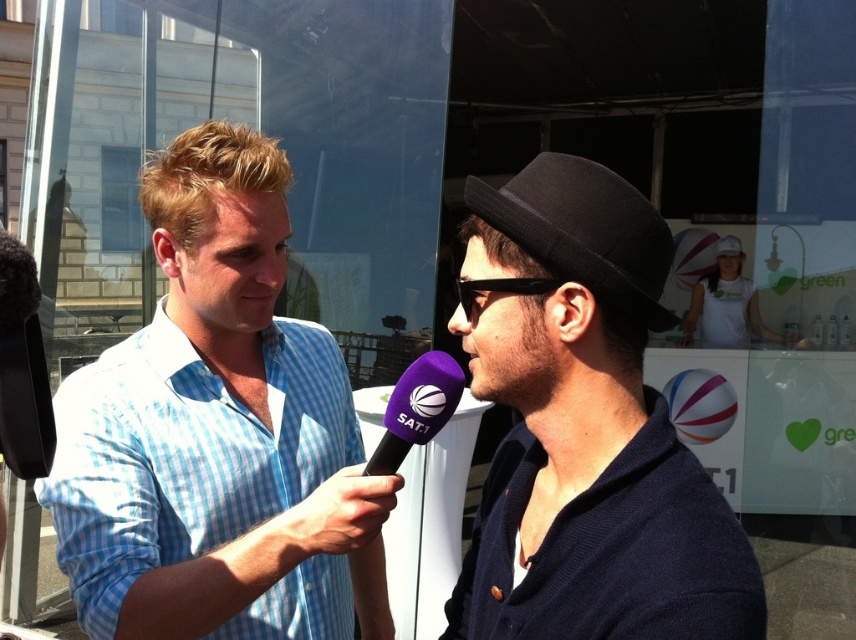
Question: Which is nearer to the blue checkered shirt at left?

Choices:
 (A) purple matte microphone at center
 (B) black plastic sunglasses at center
 (C) dark blue sweater at center

Answer: (A)

Question: Is black felt fedora at center further to camera compared to purple matte microphone at center?

Choices:
 (A) no
 (B) yes

Answer: (A)

Question: Among these objects, which one is nearest to the camera?

Choices:
 (A) purple matte microphone at center
 (B) black plastic sunglasses at center
 (C) blue checkered shirt at left

Answer: (B)

Question: Can you confirm if blue checkered shirt at left is positioned to the left of purple matte microphone at center?

Choices:
 (A) no
 (B) yes

Answer: (B)

Question: Among these points, which one is nearest to the camera?

Choices:
 (A) (195, 420)
 (B) (545, 284)

Answer: (B)

Question: Considering the relative positions of dark blue sweater at center and purple matte microphone at center in the image provided, where is dark blue sweater at center located with respect to purple matte microphone at center?

Choices:
 (A) below
 (B) above

Answer: (A)